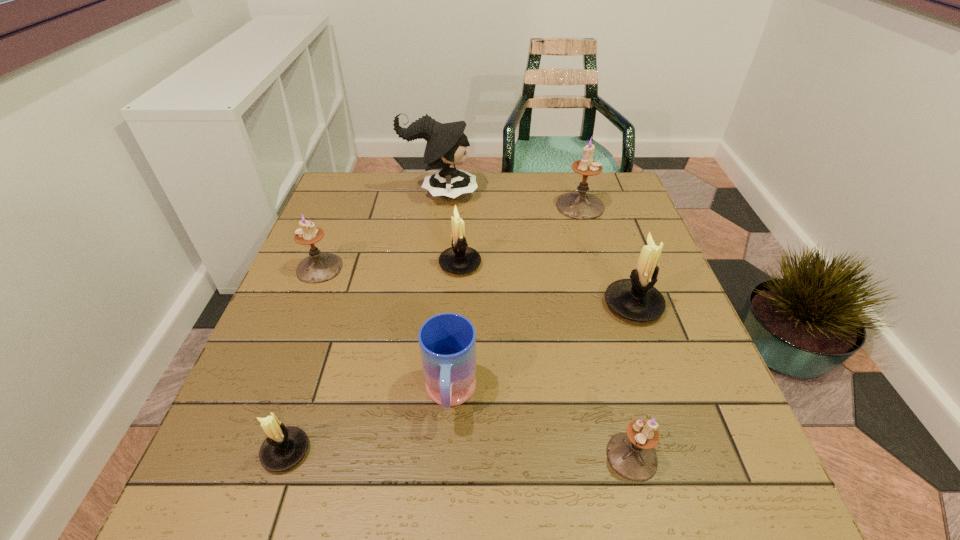
The width and height of the screenshot is (960, 540). What are the coordinates of `free space that satisfies the following two spatial constraints: 1. at the face of the second biggest white candle holder; 2. on the right side of the tallest object` in the screenshot? It's located at (431, 264).